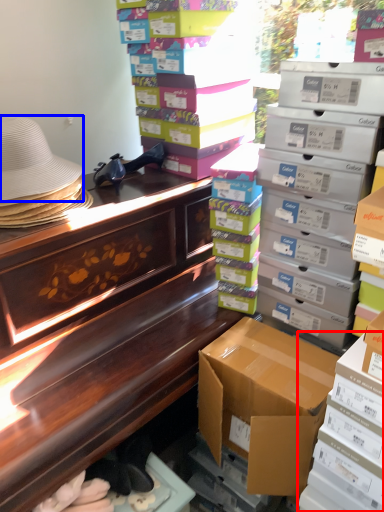
Question: Which object is closer to the camera taking this photo, box (highlighted by a red box) or hat (highlighted by a blue box)?

Choices:
 (A) box
 (B) hat

Answer: (A)